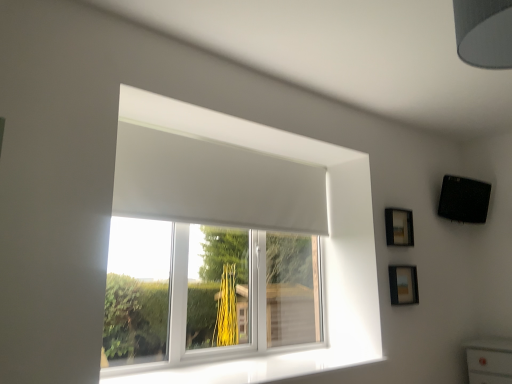
Question: Considering the relative sizes of white matte window at center and matte black picture frame at lower right, the 1th picture frame positioned from the bottom, in the image provided, is white matte window at center taller than matte black picture frame at lower right, the 1th picture frame positioned from the bottom,?

Choices:
 (A) yes
 (B) no

Answer: (A)

Question: From the image's perspective, is white matte window at center on matte black picture frame at lower right, the 2th picture frame when ordered from top to bottom?

Choices:
 (A) yes
 (B) no

Answer: (A)

Question: Is white matte window at center positioned with its back to matte black picture frame at lower right, the 1th picture frame positioned from the bottom?

Choices:
 (A) no
 (B) yes

Answer: (A)

Question: Is white matte window at center beside matte black picture frame at lower right, the 2th picture frame when ordered from top to bottom?

Choices:
 (A) no
 (B) yes

Answer: (A)

Question: Considering the relative sizes of white matte window at center and matte black picture frame at lower right, the 1th picture frame positioned from the bottom, in the image provided, is white matte window at center thinner than matte black picture frame at lower right, the 1th picture frame positioned from the bottom,?

Choices:
 (A) no
 (B) yes

Answer: (A)

Question: Is white matte window at center far from matte black picture frame at lower right, the 2th picture frame when ordered from top to bottom?

Choices:
 (A) no
 (B) yes

Answer: (A)

Question: Does gray fabric lampshade at upper right have a larger size compared to white matte window at center?

Choices:
 (A) no
 (B) yes

Answer: (A)

Question: Is gray fabric lampshade at upper right oriented away from white matte window at center?

Choices:
 (A) no
 (B) yes

Answer: (A)

Question: Is gray fabric lampshade at upper right aimed at white matte window at center?

Choices:
 (A) yes
 (B) no

Answer: (B)

Question: Would you consider gray fabric lampshade at upper right to be distant from white matte window at center?

Choices:
 (A) yes
 (B) no

Answer: (A)

Question: From a real-world perspective, is gray fabric lampshade at upper right physically below white matte window at center?

Choices:
 (A) no
 (B) yes

Answer: (A)

Question: From the image's perspective, is gray fabric lampshade at upper right under white matte window at center?

Choices:
 (A) no
 (B) yes

Answer: (A)

Question: Considering the relative sizes of white glossy window sill at lower center and gray fabric lampshade at upper right in the image provided, is white glossy window sill at lower center shorter than gray fabric lampshade at upper right?

Choices:
 (A) yes
 (B) no

Answer: (A)